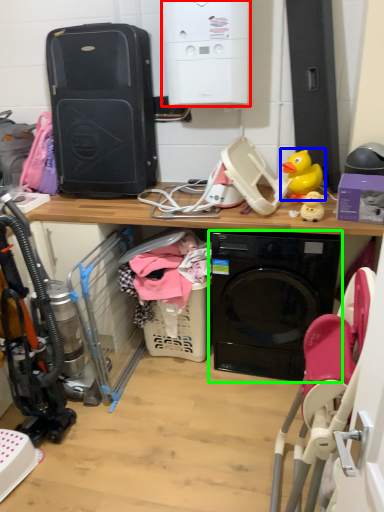
Question: Estimate the real-world distances between objects in this image. Which object is closer to appliance (highlighted by a red box), toy (highlighted by a blue box) or washing machine (highlighted by a green box)?

Choices:
 (A) toy
 (B) washing machine

Answer: (A)